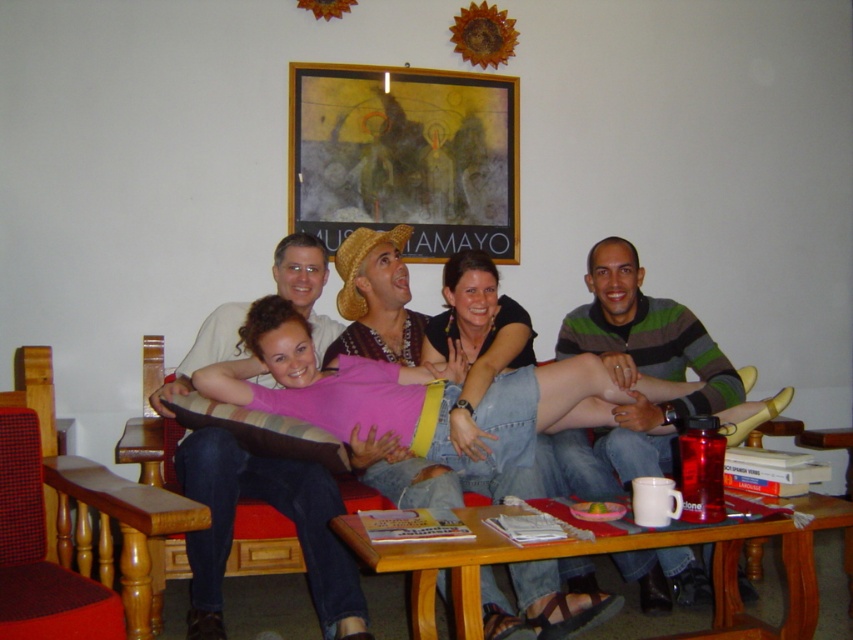
Question: Which point appears closest to the camera in this image?

Choices:
 (A) (305, 342)
 (B) (646, 540)

Answer: (B)

Question: Which object is the farthest from the wooden bench at lower left?

Choices:
 (A) wooden picture frame at upper center
 (B) pink fabric pillow at center

Answer: (A)

Question: From the image, what is the correct spatial relationship of wooden picture frame at upper center in relation to wooden table at lower center?

Choices:
 (A) below
 (B) above

Answer: (B)

Question: Does pink fabric pillow at center have a smaller size compared to wooden bench at lower left?

Choices:
 (A) no
 (B) yes

Answer: (A)

Question: Is wooden table at lower center above wooden bench at lower left?

Choices:
 (A) yes
 (B) no

Answer: (B)

Question: Estimate the real-world distances between objects in this image. Which object is farther from the pink fabric pillow at center?

Choices:
 (A) wooden table at lower center
 (B) wooden bench at lower left

Answer: (B)